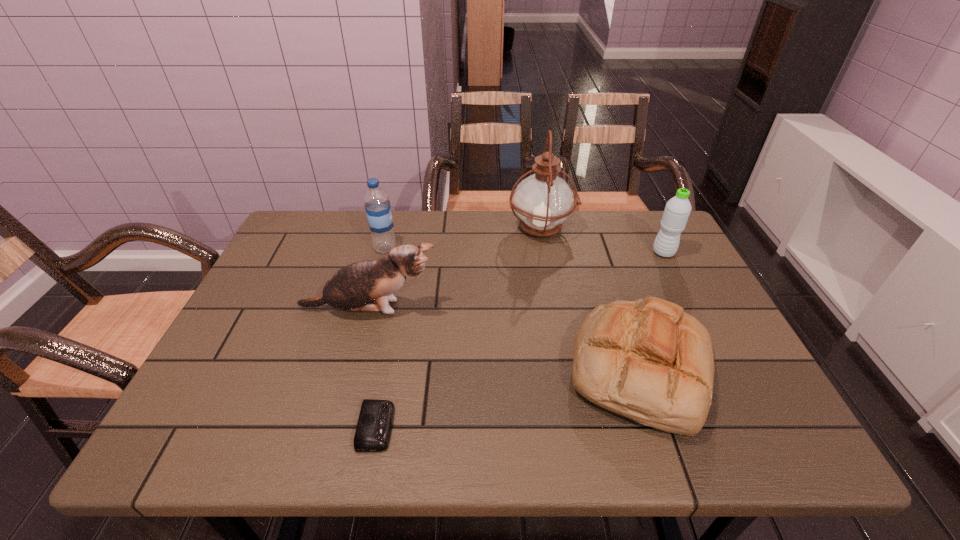
Image resolution: width=960 pixels, height=540 pixels. I want to click on vacant area that satisfies the following two spatial constraints: 1. on the label of the right water bottle; 2. on the right side of the left water bottle, so click(384, 253).